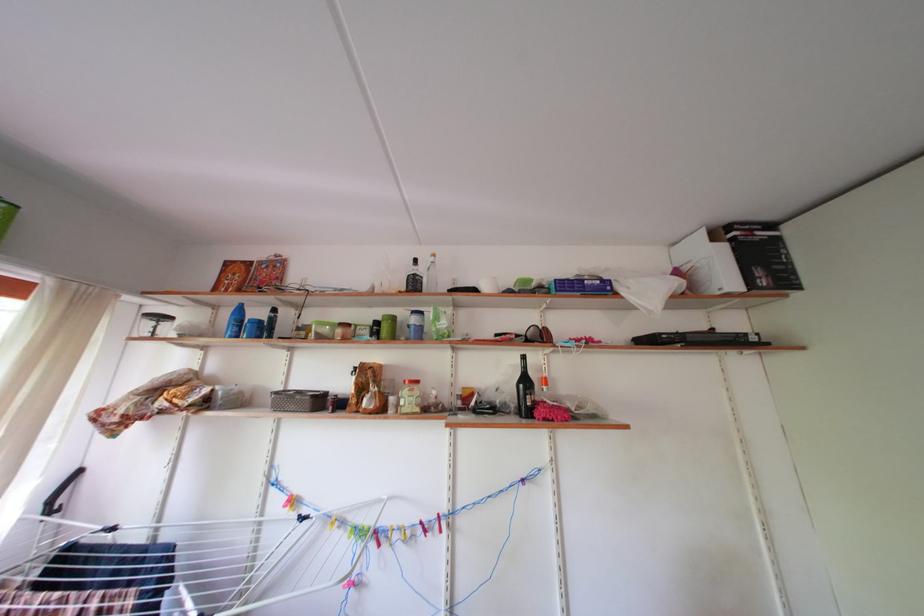
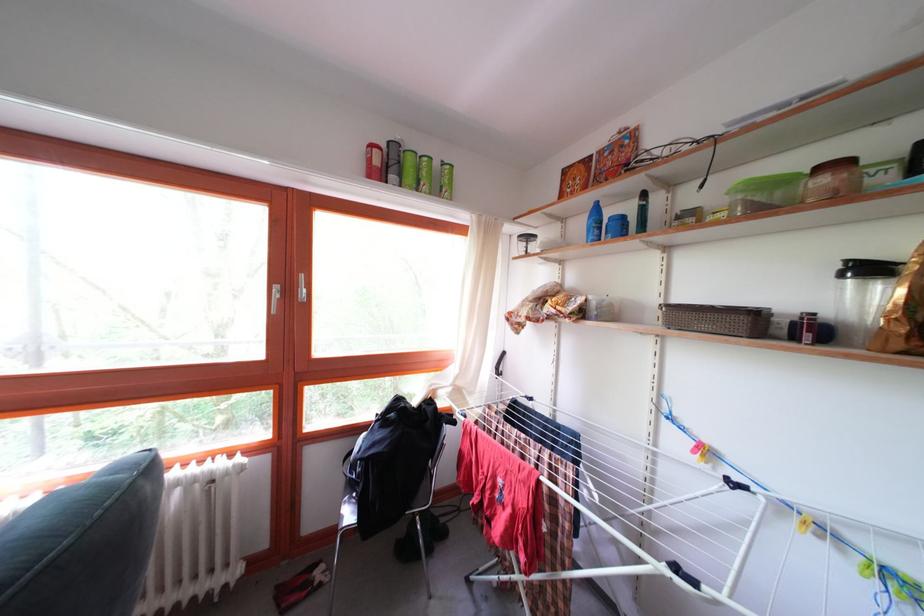
Locate, in the second image, the point that corresponds to the point at 242,305 in the first image.

(598, 204)